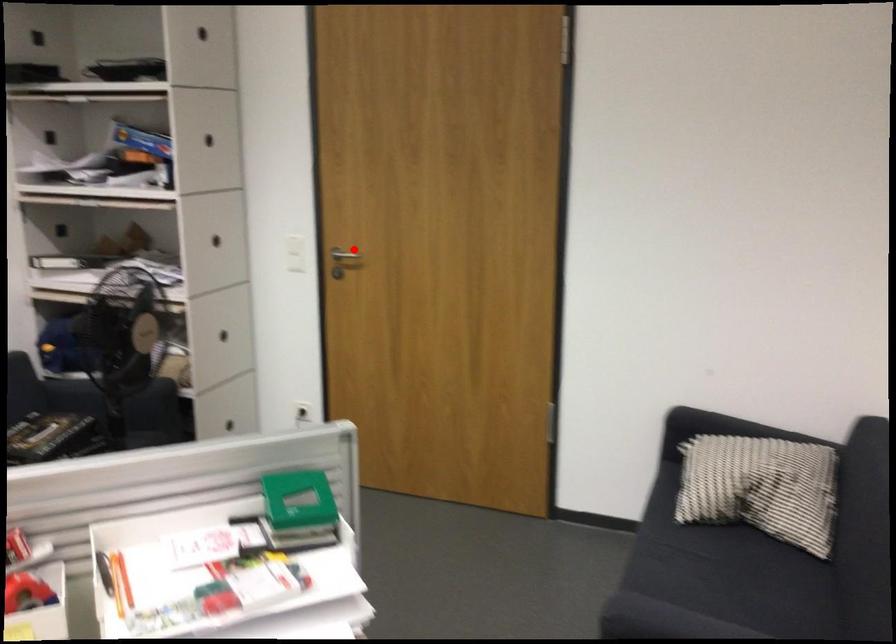
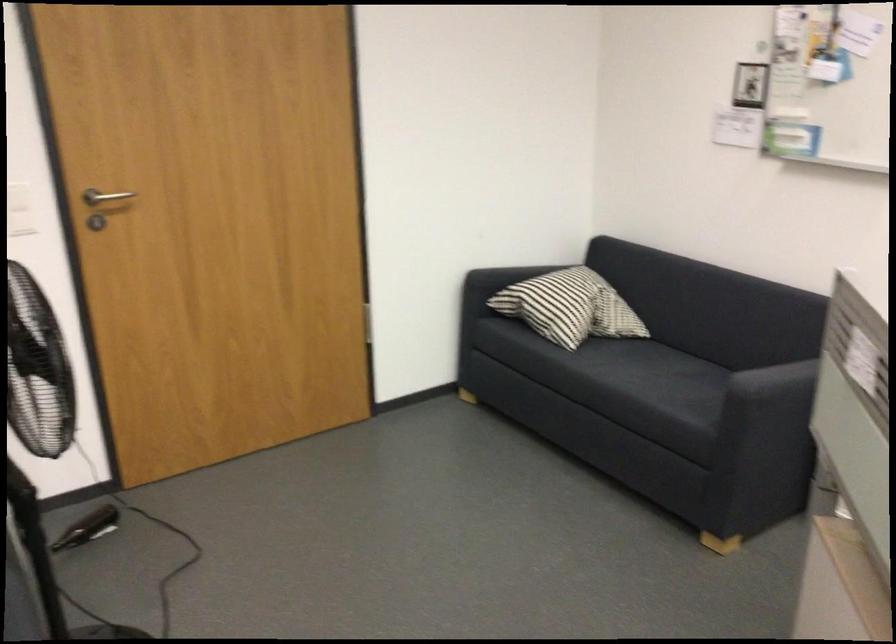
Question: I am providing you with two images of the same scene from different viewpoints. A red point is shown in image1. For the corresponding object point in image2, is it positioned nearer or farther from the camera?

Choices:
 (A) Nearer
 (B) Farther

Answer: (A)